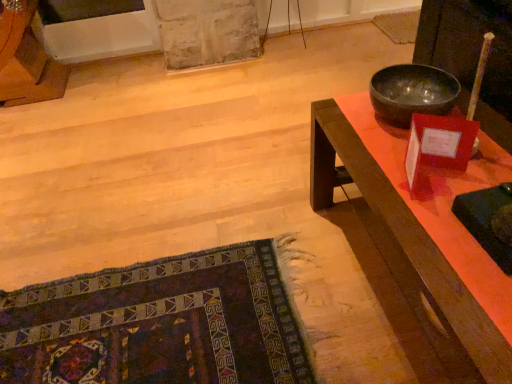
Locate an element on the screen. free space to the left of shiny metallic bowl at upper right is located at coordinates (348, 128).